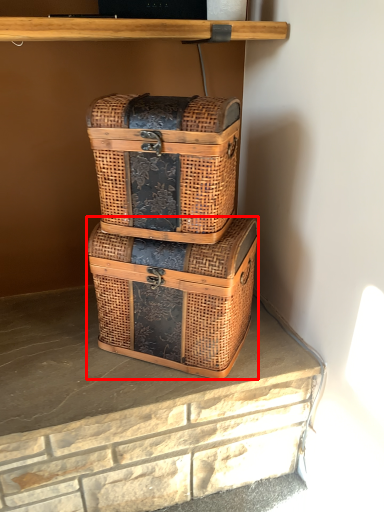
Question: From the image's perspective, where is box (annotated by the red box) located in relation to box in the image?

Choices:
 (A) above
 (B) below

Answer: (B)